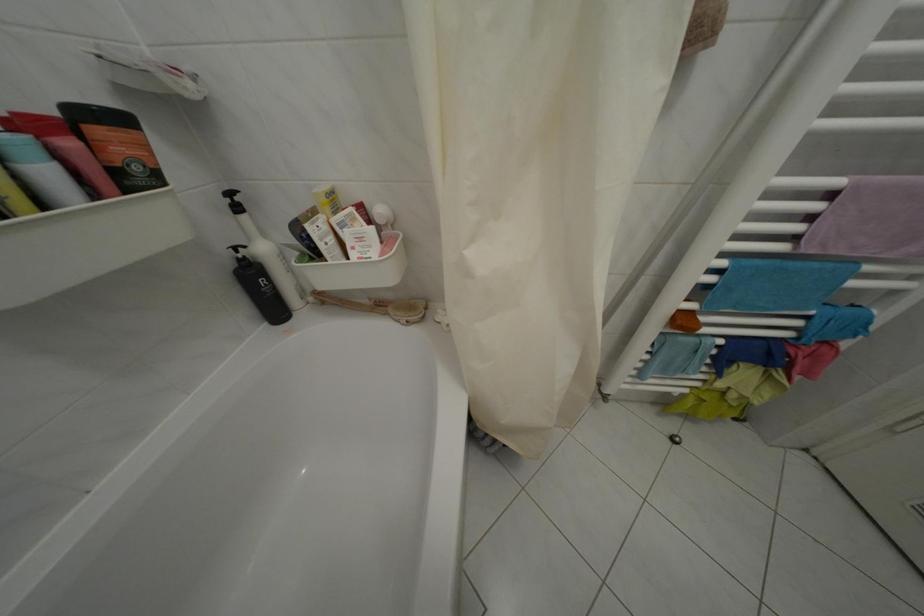
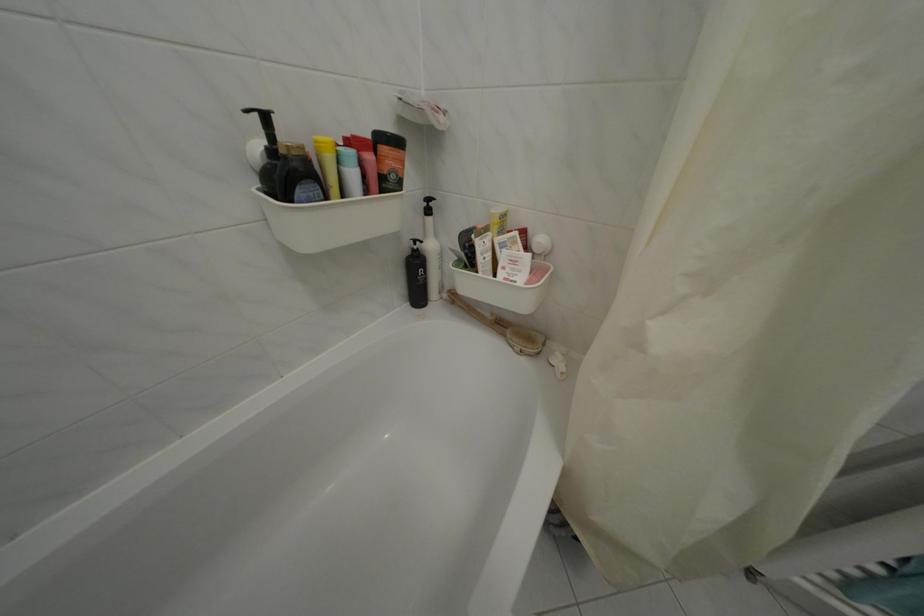
The point at (320,305) is marked in the first image. Where is the corresponding point in the second image?

(454, 302)